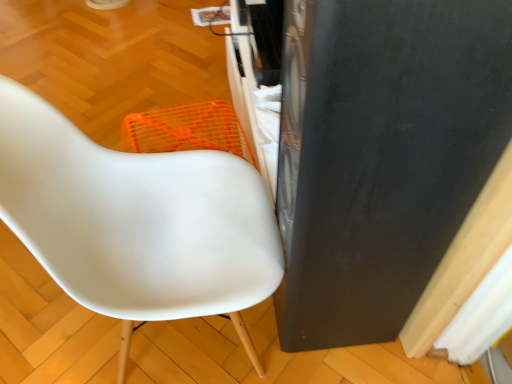
Question: Does white matte chair at center come behind black matte speaker at right?

Choices:
 (A) no
 (B) yes

Answer: (B)

Question: Can you confirm if white matte chair at center is shorter than black matte speaker at right?

Choices:
 (A) yes
 (B) no

Answer: (A)

Question: Is white matte chair at center to the right of black matte speaker at right from the viewer's perspective?

Choices:
 (A) yes
 (B) no

Answer: (B)

Question: Are white matte chair at center and black matte speaker at right far apart?

Choices:
 (A) yes
 (B) no

Answer: (B)

Question: Are white matte chair at center and black matte speaker at right making contact?

Choices:
 (A) yes
 (B) no

Answer: (B)

Question: Considering the relative sizes of white matte chair at center and black matte speaker at right in the image provided, is white matte chair at center taller than black matte speaker at right?

Choices:
 (A) no
 (B) yes

Answer: (A)

Question: Are black matte speaker at right and white matte chair at center beside each other?

Choices:
 (A) no
 (B) yes

Answer: (A)

Question: Does black matte speaker at right have a greater width compared to white matte chair at center?

Choices:
 (A) yes
 (B) no

Answer: (B)

Question: Are black matte speaker at right and white matte chair at center located far from each other?

Choices:
 (A) no
 (B) yes

Answer: (A)

Question: Does black matte speaker at right have a smaller size compared to white matte chair at center?

Choices:
 (A) yes
 (B) no

Answer: (A)

Question: Is black matte speaker at right facing towards white matte chair at center?

Choices:
 (A) yes
 (B) no

Answer: (A)

Question: From a real-world perspective, does black matte speaker at right stand above white matte chair at center?

Choices:
 (A) no
 (B) yes

Answer: (B)

Question: In terms of height, does white matte chair at center look taller or shorter compared to black matte speaker at right?

Choices:
 (A) tall
 (B) short

Answer: (B)